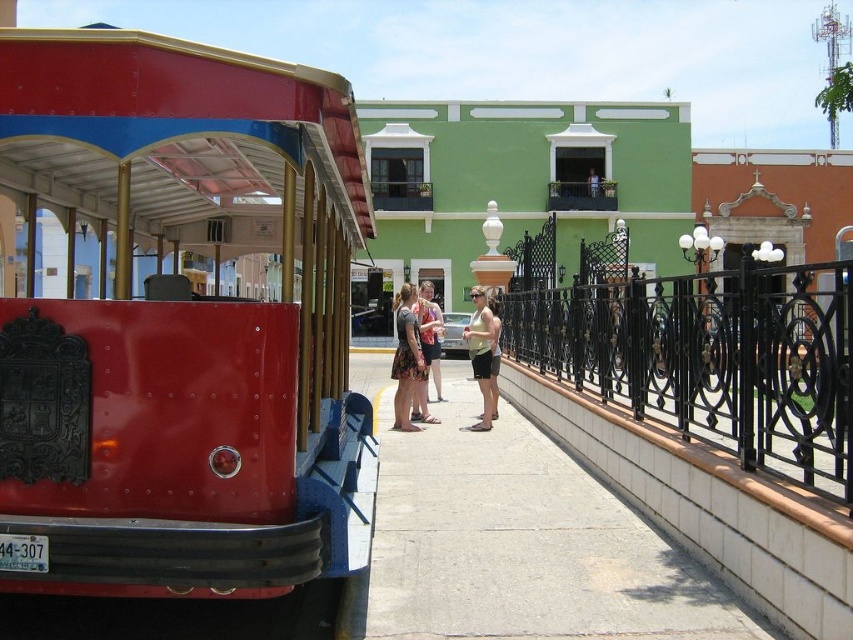
You are a pedestrian standing on the street and see the metallic red trolley at left and the floral dress at center. Which object is closer to you?

The metallic red trolley at left is closer to you because it is positioned over the floral dress at center, indicating it is in front of it.

You are a photographer planning to take a photo of two dresses displayed in a boutique window. The floral dress at center and the matte pink dress at center are both placed in the window. Based on their positions, which dress should you focus on to ensure it appears wider in the photo?

The floral dress at center might be wider than matte pink dress at center, so focusing on the floral dress at center would likely make it appear wider in the photo.